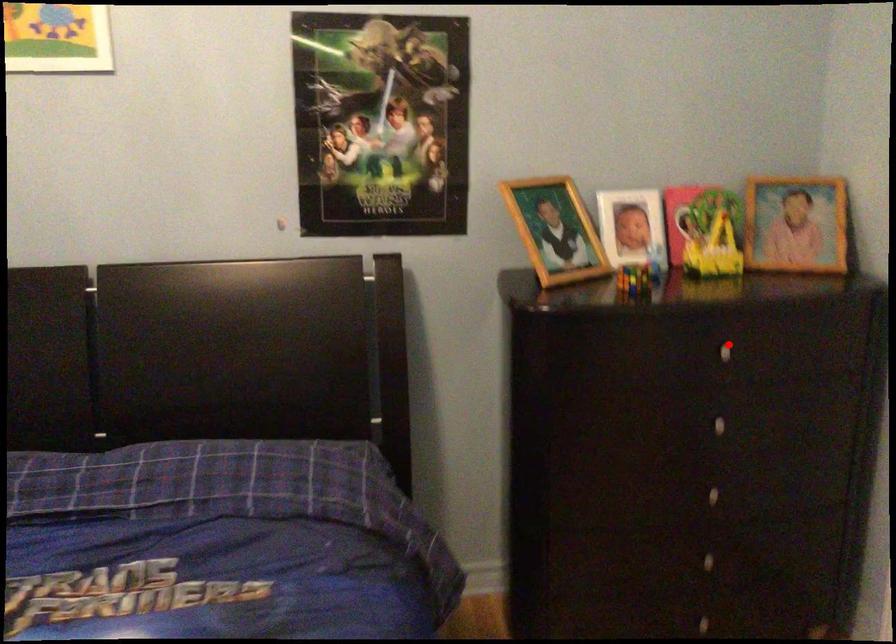
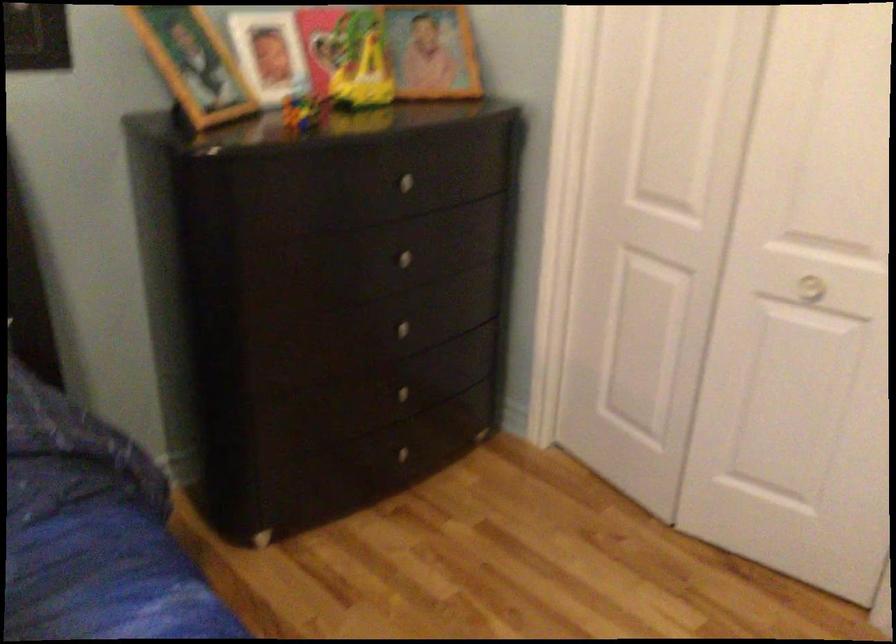
Find the pixel in the second image that matches the highlighted location in the first image.

(408, 178)